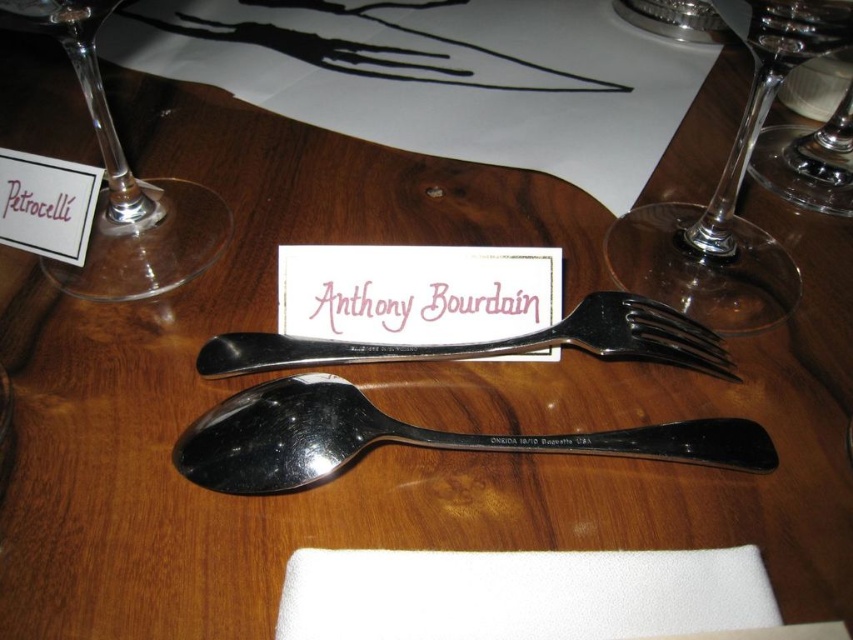
You are a server at a formal dinner and need to place a 6 cm long decorative ribbon between the white fabric napkin at center and the polished silver spoon at center. Can you fit the ribbon between them without overlapping either item?

The distance between the white fabric napkin at center and the polished silver spoon at center is 5.67 centimeters. Since the ribbon is 6 cm long, it cannot fit between them without overlapping either item.

You are a guest at a formal dinner and you see the white fabric napkin at center and the polished silver spoon at center on the table. Which object is nearer to you?

The white fabric napkin at center is closer to the viewer than the polished silver spoon at center.

Please provide the coordinates of the transparent glass wine glass at upper right on the table.

The transparent glass wine glass at upper right is located at coordinates point (729, 189).